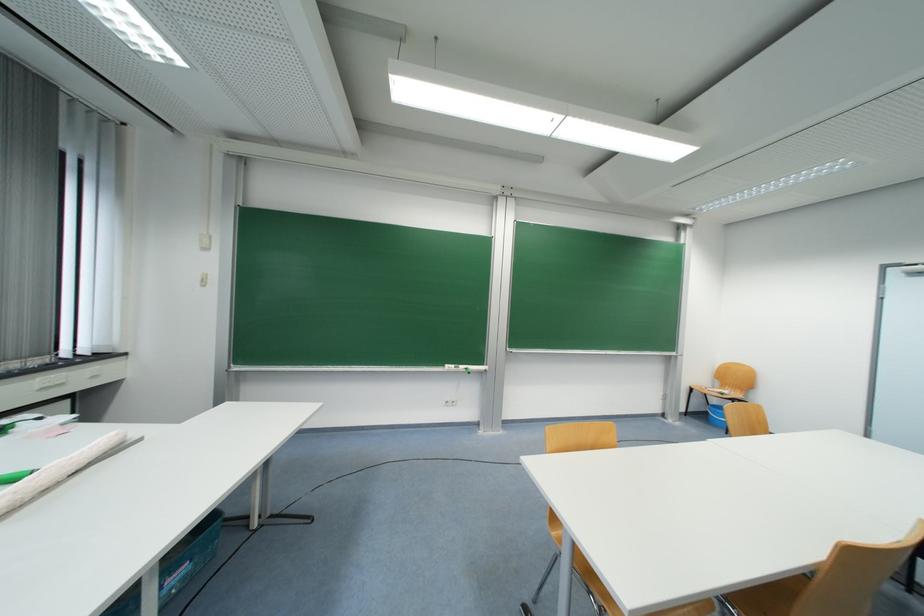
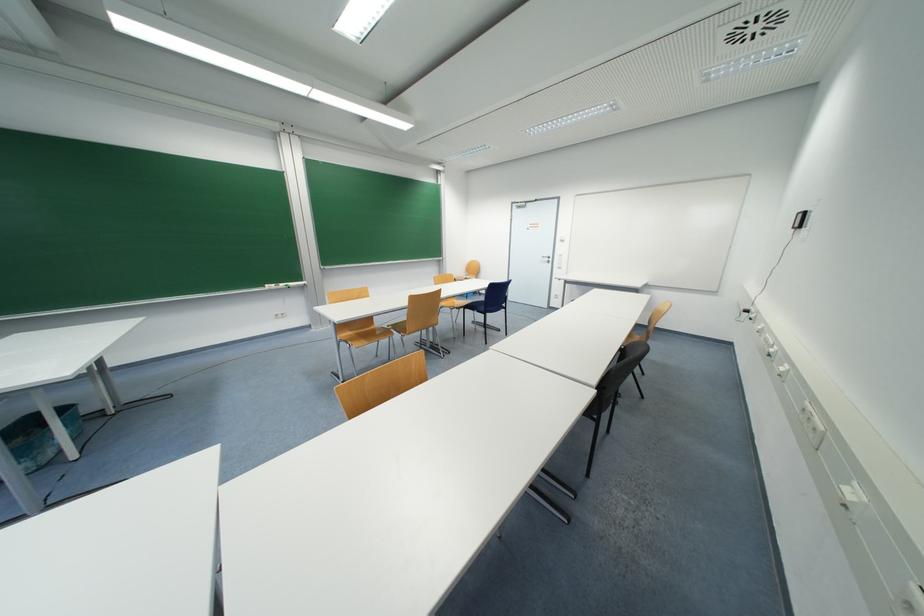
Locate, in the second image, the point that corresponds to [467,369] in the first image.

(286, 286)